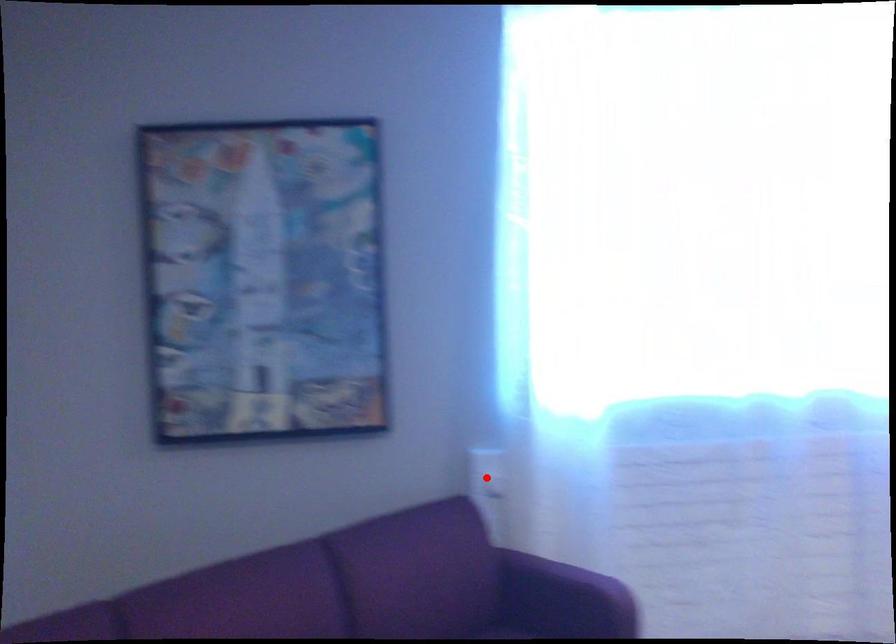
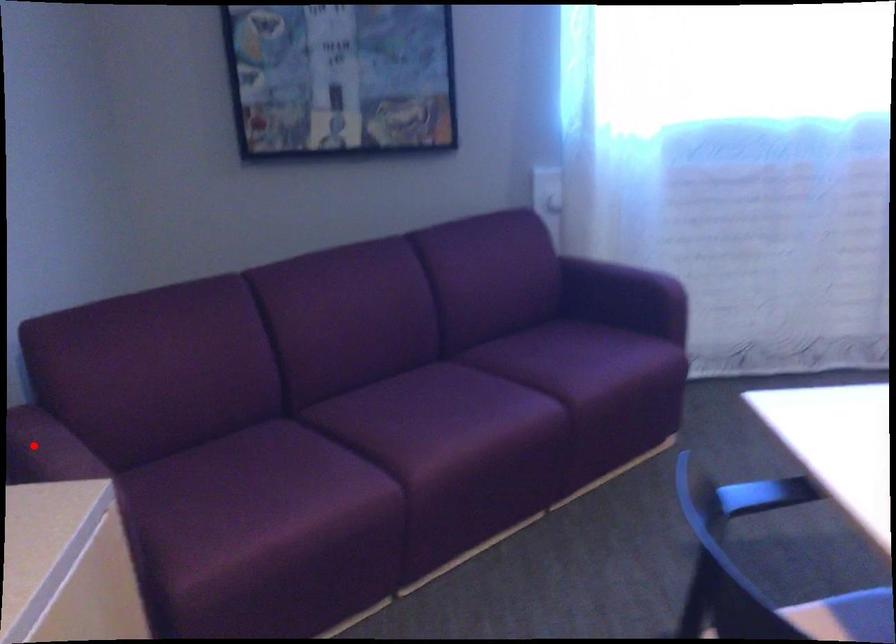
I am providing you with two images of the same scene from different viewpoints. A red point is marked on the first image and another point is marked on the second image. Are the points marked in image1 and image2 representing the same 3D position?

No